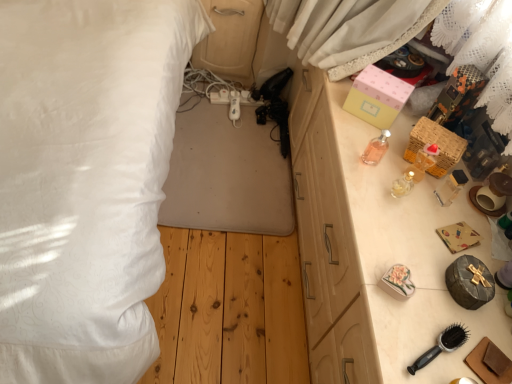
Question: From a real-world perspective, is black plastic hairbrush at lower right on wooden drawer at right?

Choices:
 (A) no
 (B) yes

Answer: (B)

Question: Considering the relative positions of black plastic hairbrush at lower right and wooden drawer at right in the image provided, is black plastic hairbrush at lower right behind wooden drawer at right?

Choices:
 (A) no
 (B) yes

Answer: (A)

Question: Can you confirm if black plastic hairbrush at lower right is thinner than wooden drawer at right?

Choices:
 (A) no
 (B) yes

Answer: (B)

Question: Can you confirm if black plastic hairbrush at lower right is wider than wooden drawer at right?

Choices:
 (A) yes
 (B) no

Answer: (B)

Question: From a real-world perspective, is black plastic hairbrush at lower right below wooden drawer at right?

Choices:
 (A) no
 (B) yes

Answer: (A)

Question: Is black plastic hairbrush at lower right far from wooden drawer at right?

Choices:
 (A) no
 (B) yes

Answer: (A)

Question: From the image's perspective, is woven wicker basket at right, arranged as the first box when ordered from the bottom, located above pink glass perfume at upper right?

Choices:
 (A) yes
 (B) no

Answer: (B)

Question: From the image's perspective, does woven wicker basket at right, arranged as the first box when ordered from the bottom, appear lower than pink glass perfume at upper right?

Choices:
 (A) no
 (B) yes

Answer: (B)

Question: Considering the relative sizes of woven wicker basket at right, arranged as the first box when ordered from the bottom, and pink glass perfume at upper right in the image provided, is woven wicker basket at right, arranged as the first box when ordered from the bottom, wider than pink glass perfume at upper right?

Choices:
 (A) yes
 (B) no

Answer: (A)

Question: Is woven wicker basket at right, arranged as the first box when ordered from the bottom, thinner than pink glass perfume at upper right?

Choices:
 (A) yes
 (B) no

Answer: (B)

Question: Can pink glass perfume at upper right be found inside woven wicker basket at right, marked as the second box in a top-to-bottom arrangement?

Choices:
 (A) no
 (B) yes

Answer: (A)

Question: From a real-world perspective, is woven wicker basket at right, arranged as the first box when ordered from the bottom, over pink glass perfume at upper right?

Choices:
 (A) yes
 (B) no

Answer: (B)

Question: Can you see pink paper box at upper right, which ranks as the 1th box in top-to-bottom order, touching matte wood dresser at center?

Choices:
 (A) no
 (B) yes

Answer: (A)